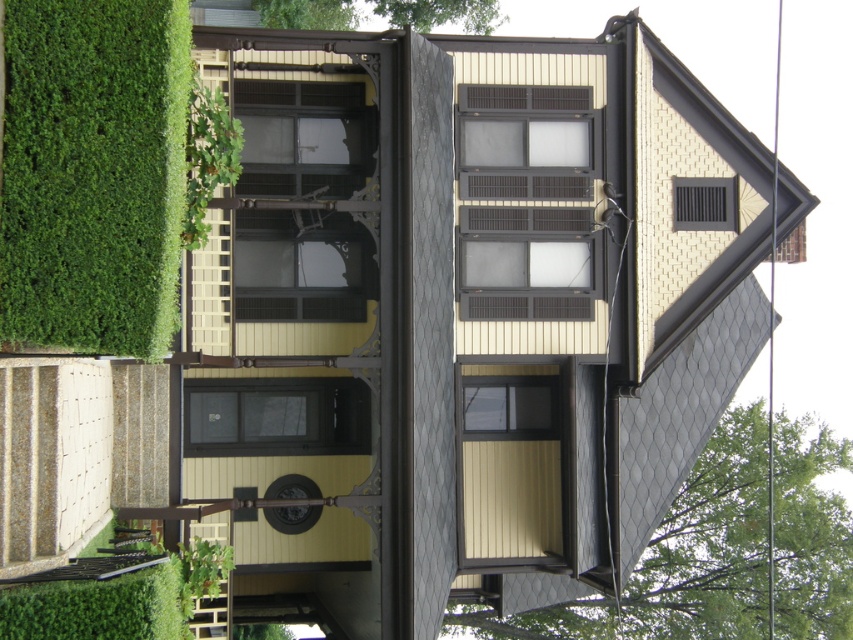
Who is more forward, (102, 100) or (123, 582)?

Point (123, 582) is more forward.

Is point (49, 259) positioned after point (57, 580)?

Yes, point (49, 259) is farther from viewer.

Is point (170, 218) closer to viewer compared to point (74, 588)?

No, it is behind (74, 588).

Identify the location of green leafy hedge at left. (93, 173).

Is green leafy tree at upper right wider than green leafy hedge at lower left?

Yes, green leafy tree at upper right is wider than green leafy hedge at lower left.

Can you confirm if green leafy tree at upper right is bigger than green leafy hedge at lower left?

Yes.

I want to click on green leafy tree at upper right, so click(x=680, y=557).

Between green leafy hedge at lower left and green leafy plant at upper left, which one has less height?

green leafy hedge at lower left is shorter.

Can you confirm if green leafy hedge at lower left is taller than green leafy plant at upper left?

No.

Find the location of a particular element. Image resolution: width=853 pixels, height=640 pixels. green leafy hedge at lower left is located at coordinates (96, 608).

Where is `green leafy hedge at lower left`? Image resolution: width=853 pixels, height=640 pixels. green leafy hedge at lower left is located at coordinates (96, 608).